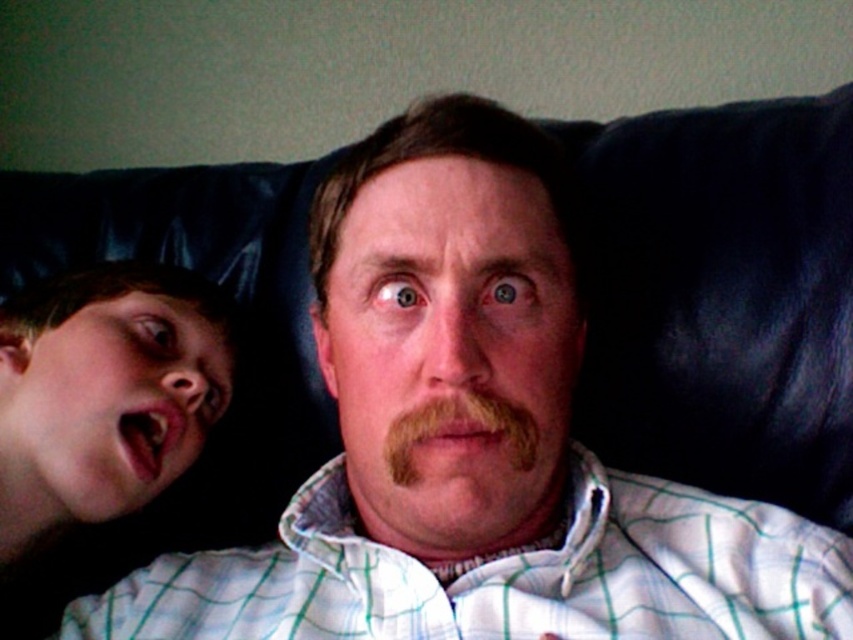
Who is positioned more to the left, black leather couch at upper center or brown fuzzy mustache at center?

black leather couch at upper center is more to the left.

Who is more distant from viewer, (213, 488) or (425, 417)?

Positioned behind is point (213, 488).

Locate an element on the screen. Image resolution: width=853 pixels, height=640 pixels. black leather couch at upper center is located at coordinates (722, 298).

Between smooth skin face at left and brown fuzzy mustache at center, which one is positioned lower?

brown fuzzy mustache at center

The image size is (853, 640). What do you see at coordinates (103, 396) in the screenshot?
I see `smooth skin face at left` at bounding box center [103, 396].

Locate an element on the screen. smooth skin face at left is located at coordinates (103, 396).

Can you confirm if black leather couch at upper center is positioned above smooth skin face at left?

Yes.

Is point (80, 202) behind point (229, 364)?

Yes.

At what (x,y) coordinates should I click in order to perform the action: click on black leather couch at upper center. Please return your answer as a coordinate pair (x, y). Looking at the image, I should click on (722, 298).